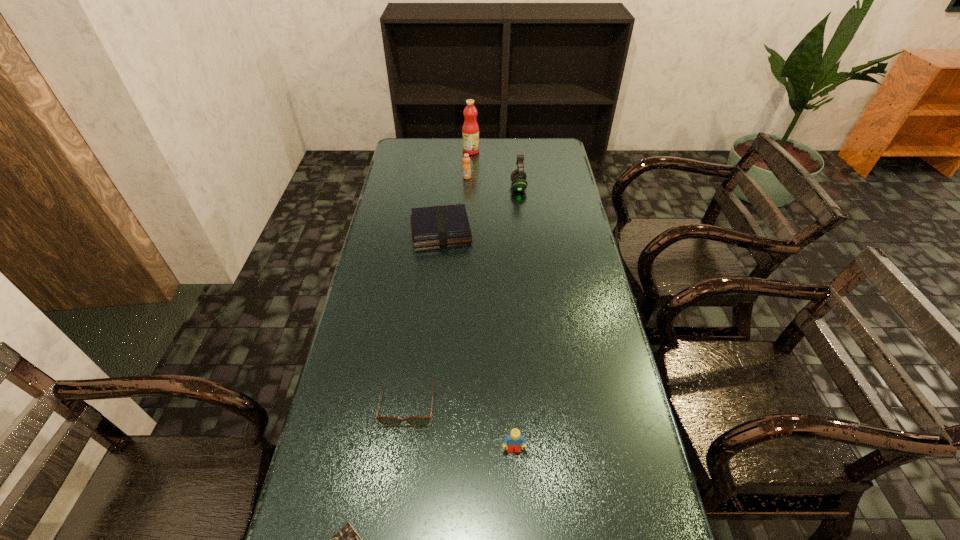
What are the coordinates of `free space between the Lego and the farthest object` in the screenshot? It's located at (492, 300).

Identify the location of blank region between the Lego and the third tallest object. (491, 313).

Image resolution: width=960 pixels, height=540 pixels. I want to click on object that stands as the fourth closest to the sixth shortest object, so click(419, 421).

Identify the location of object that stands as the fourth closest to the shortest object. The width and height of the screenshot is (960, 540). (518, 177).

Where is `free region that satisfies the following two spatial constraints: 1. on the ear cups of the rightmost object; 2. on the face of the sixth object from left to right`? This screenshot has width=960, height=540. free region that satisfies the following two spatial constraints: 1. on the ear cups of the rightmost object; 2. on the face of the sixth object from left to right is located at coordinates (547, 449).

Locate an element on the screen. This screenshot has width=960, height=540. vacant space that satisfies the following two spatial constraints: 1. on the ear cups of the headset; 2. on the face of the fourth shortest object is located at coordinates (547, 449).